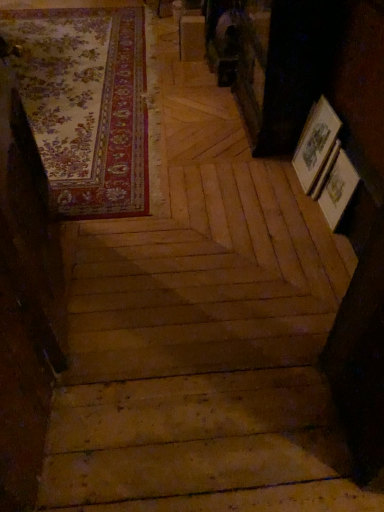
Question: Considering the positions of wooden stairs at center and floral carpet at upper left in the image, is wooden stairs at center taller or shorter than floral carpet at upper left?

Choices:
 (A) tall
 (B) short

Answer: (B)

Question: Considering the positions of point (284, 436) and point (124, 179), is point (284, 436) closer or farther from the camera than point (124, 179)?

Choices:
 (A) farther
 (B) closer

Answer: (B)

Question: Is wooden stairs at center inside or outside of floral carpet at upper left?

Choices:
 (A) inside
 (B) outside

Answer: (A)

Question: Is point 115,99 positioned closer to the camera than point 114,500?

Choices:
 (A) farther
 (B) closer

Answer: (A)

Question: Relative to wooden stairs at center, is floral carpet at upper left in front or behind?

Choices:
 (A) front
 (B) behind

Answer: (B)

Question: Is floral carpet at upper left taller or shorter than wooden stairs at center?

Choices:
 (A) tall
 (B) short

Answer: (A)

Question: In terms of size, does floral carpet at upper left appear bigger or smaller than wooden stairs at center?

Choices:
 (A) big
 (B) small

Answer: (B)